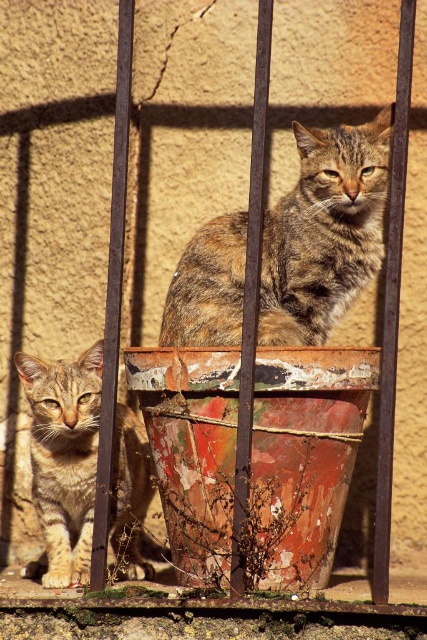
Question: Does tabby fur cat at center have a greater width compared to tabby fur cat at left?

Choices:
 (A) no
 (B) yes

Answer: (B)

Question: Which point is farther to the camera?

Choices:
 (A) tabby fur cat at left
 (B) tabby fur cat at center

Answer: (A)

Question: Which point appears closest to the camera in this image?

Choices:
 (A) (195, 232)
 (B) (99, 403)

Answer: (B)

Question: Is tabby fur cat at center positioned behind tabby fur cat at left?

Choices:
 (A) yes
 (B) no

Answer: (B)

Question: From the image, what is the correct spatial relationship of tabby fur cat at center in relation to tabby fur cat at left?

Choices:
 (A) above
 (B) below

Answer: (A)